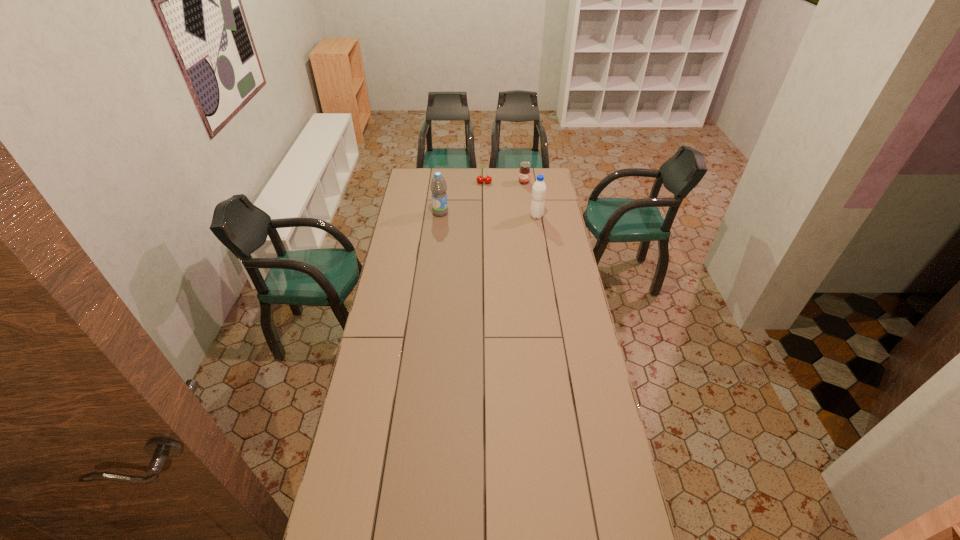
At what (x,y) coordinates should I click in order to perform the action: click on the leftmost object. Please return your answer as a coordinate pair (x, y). The width and height of the screenshot is (960, 540). Looking at the image, I should click on (438, 185).

Where is `the right water bottle`? The width and height of the screenshot is (960, 540). the right water bottle is located at coordinates (x=539, y=188).

Where is `cherry`? Image resolution: width=960 pixels, height=540 pixels. cherry is located at coordinates (480, 179).

Where is `jam`? Image resolution: width=960 pixels, height=540 pixels. jam is located at coordinates (524, 173).

You are a GUI agent. You are given a task and a screenshot of the screen. Output one action in this format:
    pyautogui.click(x=<x>, y=<y>)
    Task: Click on the free region located on the left of the left water bottle
    This screenshot has width=960, height=540.
    Given the screenshot: What is the action you would take?
    pyautogui.click(x=399, y=213)

The height and width of the screenshot is (540, 960). I want to click on blank area located 0.150m on the back of the right water bottle, so click(x=534, y=198).

The height and width of the screenshot is (540, 960). I want to click on free region located 0.110m with the stems of the cherry pointing upwards, so click(x=482, y=195).

I want to click on vacant space located 0.280m with the stems of the cherry pointing upwards, so click(x=480, y=211).

Find the location of `free space located 0.280m with the stems of the cherry pointing upwards`. free space located 0.280m with the stems of the cherry pointing upwards is located at coordinates (480, 211).

What are the coordinates of `vacant area situated on the label side of the jam` in the screenshot? It's located at (507, 205).